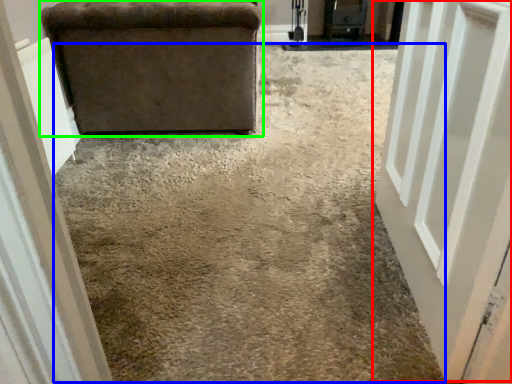
Question: Which object is positioned closest to door (highlighted by a red box)? Select from concrete (highlighted by a blue box) and furniture (highlighted by a green box).

Choices:
 (A) concrete
 (B) furniture

Answer: (A)